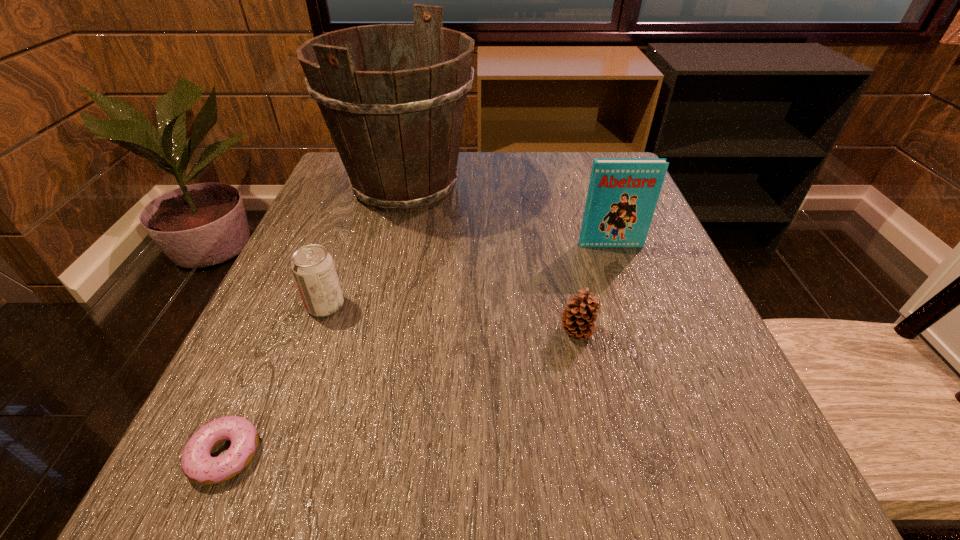
Identify the location of vacant area between the tallest object and the fourth nearest object. This screenshot has height=540, width=960. (508, 215).

Identify the location of free space between the doughnut and the fourth object from left to right. (400, 393).

Identify the location of free space between the soda can and the shortest object. This screenshot has height=540, width=960. (276, 380).

You are a GUI agent. You are given a task and a screenshot of the screen. Output one action in this format:
    pyautogui.click(x=<x>, y=<y>)
    Task: Click on the unoccupied area between the fourth tallest object and the bucket
    The image size is (960, 540).
    Given the screenshot: What is the action you would take?
    pyautogui.click(x=491, y=259)

Image resolution: width=960 pixels, height=540 pixels. Identify the location of free space between the soda can and the rightmost object. (468, 275).

I want to click on vacant space that's between the doughnut and the soda can, so click(276, 380).

You are a GUI agent. You are given a task and a screenshot of the screen. Output one action in this format:
    pyautogui.click(x=<x>, y=<y>)
    Task: Click on the vacant region between the book and the pinecone
    
    Given the screenshot: What is the action you would take?
    pyautogui.click(x=594, y=288)

This screenshot has height=540, width=960. I want to click on vacant region between the book and the soda can, so click(x=468, y=275).

Where is `the second closest object to the nearest object`? This screenshot has height=540, width=960. the second closest object to the nearest object is located at coordinates (578, 318).

Identify which object is the fourth nearest to the pinecone. Please provide its 2D coordinates. Your answer should be formatted as a tuple, i.e. [(x, y)], where the tuple contains the x and y coordinates of a point satisfying the conditions above.

[(198, 465)]